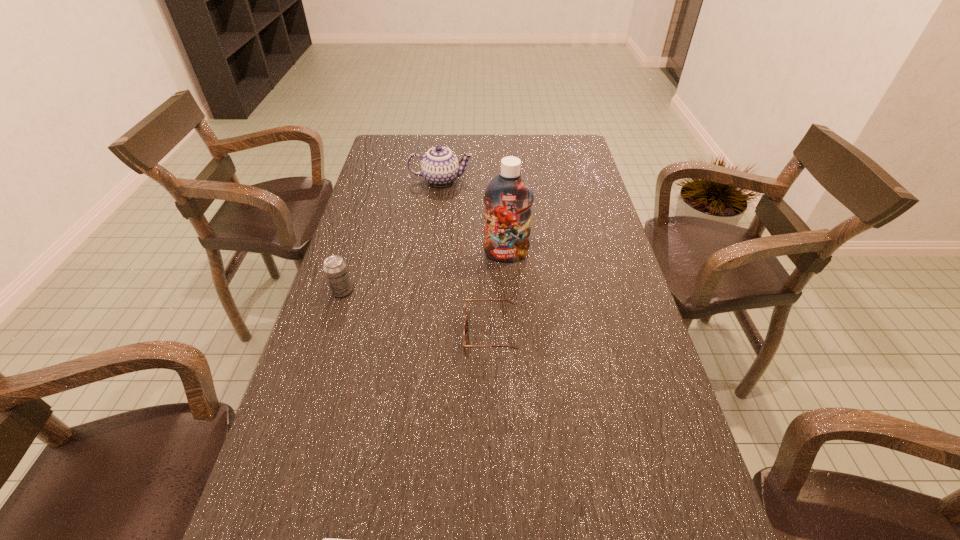
Where is `vacant space located on the back of the leftmost object`? Image resolution: width=960 pixels, height=540 pixels. vacant space located on the back of the leftmost object is located at coordinates (352, 259).

I want to click on free space located at the front view of the second shortest object, so click(415, 334).

Find the location of a particular element. vacant space located 0.250m at the front view of the second shortest object is located at coordinates (361, 334).

Identify the location of vacant space located 0.230m at the front view of the second shortest object. This screenshot has height=540, width=960. (370, 334).

Where is `chinaware that is at the left edge`? chinaware that is at the left edge is located at coordinates (440, 167).

You are a GUI agent. You are given a task and a screenshot of the screen. Output one action in this format:
    pyautogui.click(x=<x>, y=<y>)
    Task: Click on the beer can that is at the left edge
    
    Given the screenshot: What is the action you would take?
    pyautogui.click(x=335, y=269)

Locate an element on the screen. The width and height of the screenshot is (960, 540). free space at the far edge of the desktop is located at coordinates (538, 146).

Find the location of a particular element. The width and height of the screenshot is (960, 540). vacant space at the left edge of the desktop is located at coordinates (357, 447).

I want to click on vacant region at the right edge, so click(611, 332).

You are a GUI agent. You are given a task and a screenshot of the screen. Output one action in this format:
    pyautogui.click(x=<x>, y=<y>)
    Task: Click on the free region at the far left corner of the desktop
    The height and width of the screenshot is (540, 960).
    Given the screenshot: What is the action you would take?
    pyautogui.click(x=413, y=153)